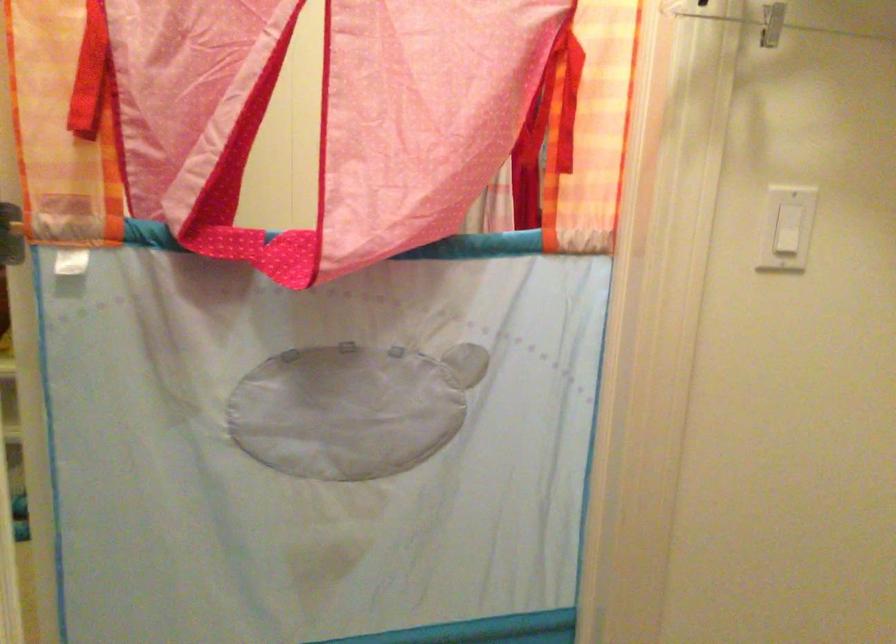
The height and width of the screenshot is (644, 896). What do you see at coordinates (787, 230) in the screenshot? I see `the white light switch` at bounding box center [787, 230].